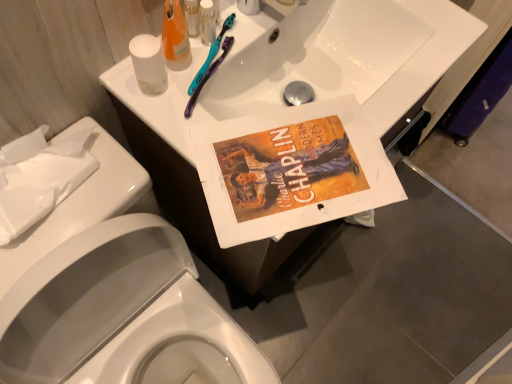
Locate an element on the screen. The width and height of the screenshot is (512, 384). vacant area located to the right-hand side of white paper towel at left, marked as the 2th porcelain in a front-to-back arrangement is located at coordinates (106, 201).